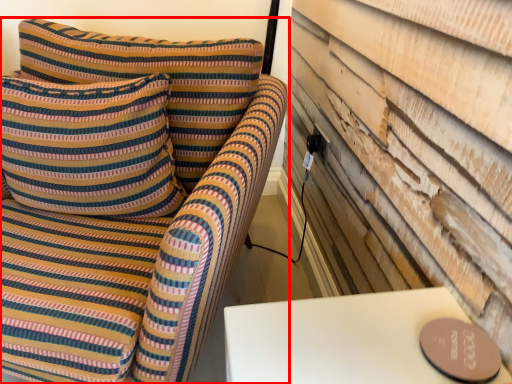
Question: From the image's perspective, what is the correct spatial positioning of furniture (annotated by the red box) in reference to pillow?

Choices:
 (A) above
 (B) below

Answer: (B)